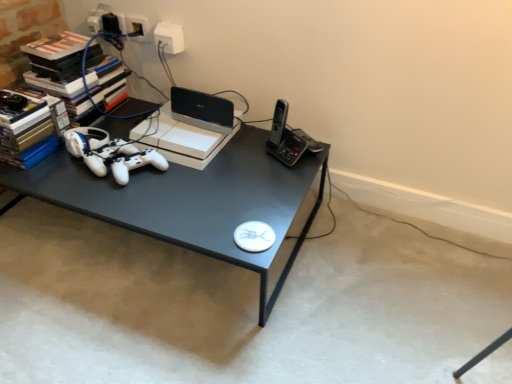
Question: Is point (210, 109) positioned closer to the camera than point (247, 190)?

Choices:
 (A) closer
 (B) farther

Answer: (B)

Question: From their relative heights in the image, would you say black plastic router at upper center is taller or shorter than matte black desk at center?

Choices:
 (A) short
 (B) tall

Answer: (A)

Question: Which object is positioned farthest from the white plastic outlet at upper center?

Choices:
 (A) black plastic router at upper center
 (B) matte black desk at center
 (C) white matte game controller at center

Answer: (B)

Question: Considering the real-world distances, which object is closest to the white matte game controller at center?

Choices:
 (A) black plastic router at upper center
 (B) white plastic outlet at upper center
 (C) matte black desk at center

Answer: (C)